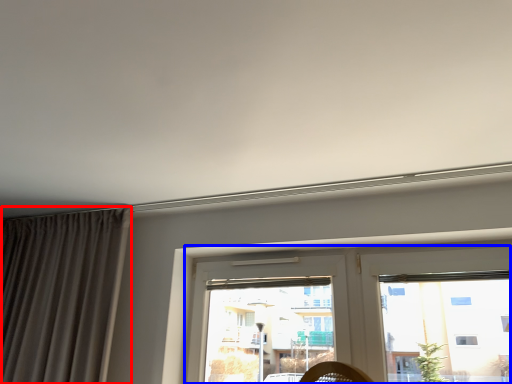
Question: Which object is closer to the camera taking this photo, curtain (highlighted by a red box) or window (highlighted by a blue box)?

Choices:
 (A) curtain
 (B) window

Answer: (B)